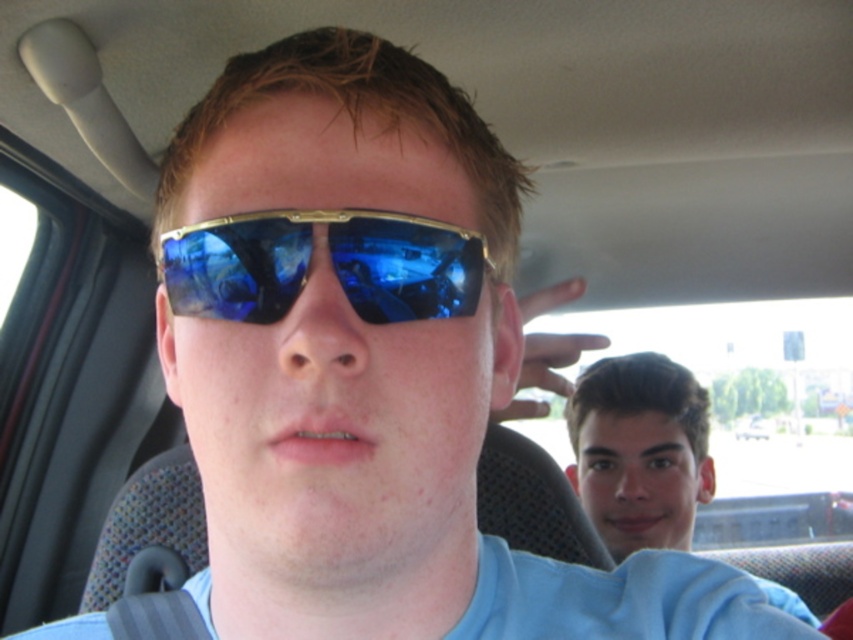
You are a passenger in the car and want to take a photo of the smooth skin face at right without the blue reflective lens at center appearing in the shot. How should you adjust your camera angle?

Move the camera to the right side so that the blue reflective lens at center is no longer in the frame, allowing you to capture the smooth skin face at right without obstruction.

You are a photographer taking a portrait of the two people in the car. You notice the blue reflective lens at center and the smooth skin face at right. Which object should you adjust your camera focus on to ensure the smaller one is sharp?

You should focus on the blue reflective lens at center because it has a smaller size compared to the smooth skin face at right, making it harder to capture sharply.

You are a photographer taking a portrait of the two people in the car. You notice the blue reflective lens at center and the smooth skin face at right. Which object is narrower in width?

The blue reflective lens at center is thinner than the smooth skin face at right, so the blue reflective lens at center is narrower in width.